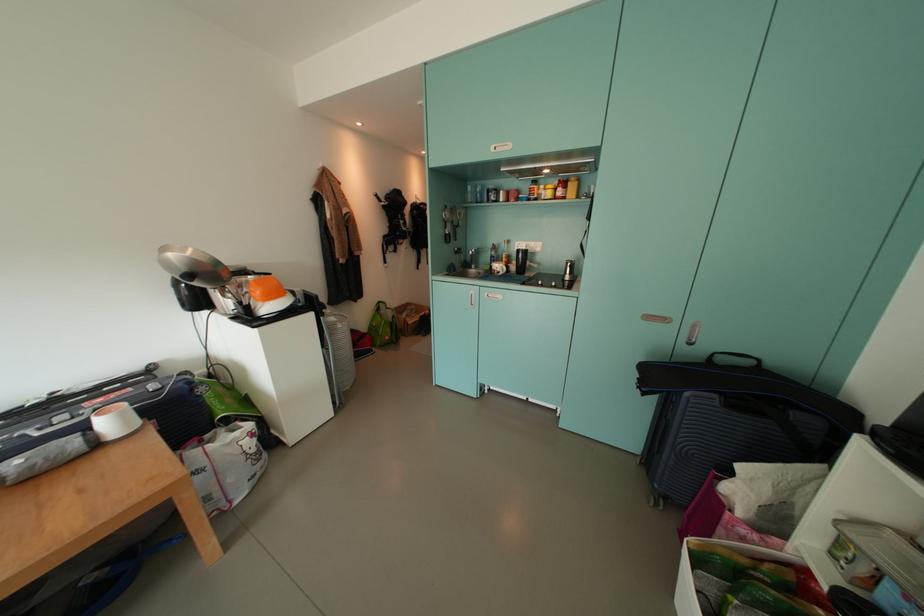
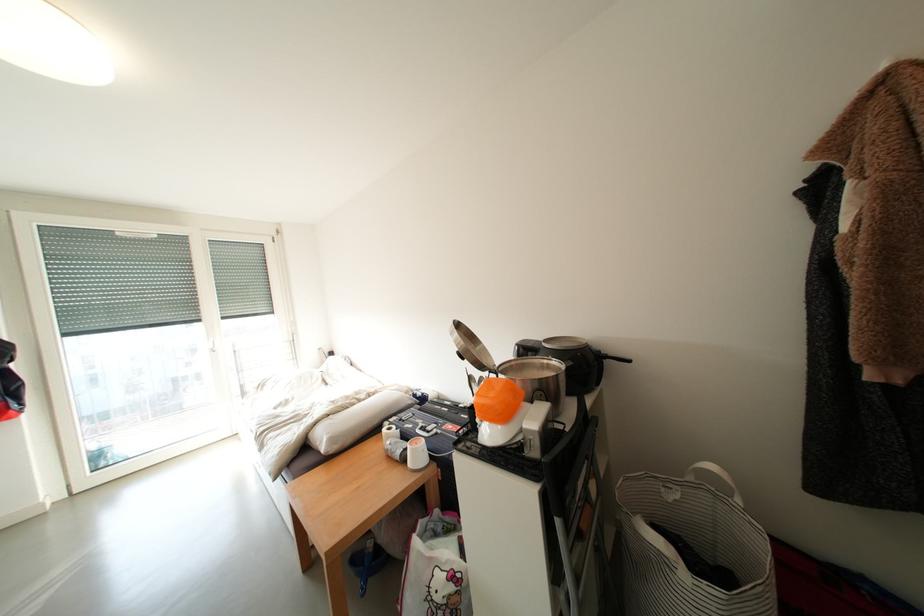
Find the pixel in the second image that matches pixel 123 426 in the first image.

(424, 456)